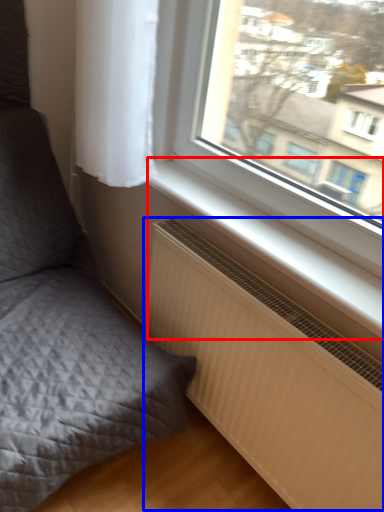
Question: Which point is closer to the camera, window sill (highlighted by a red box) or radiator (highlighted by a blue box)?

Choices:
 (A) window sill
 (B) radiator

Answer: (B)